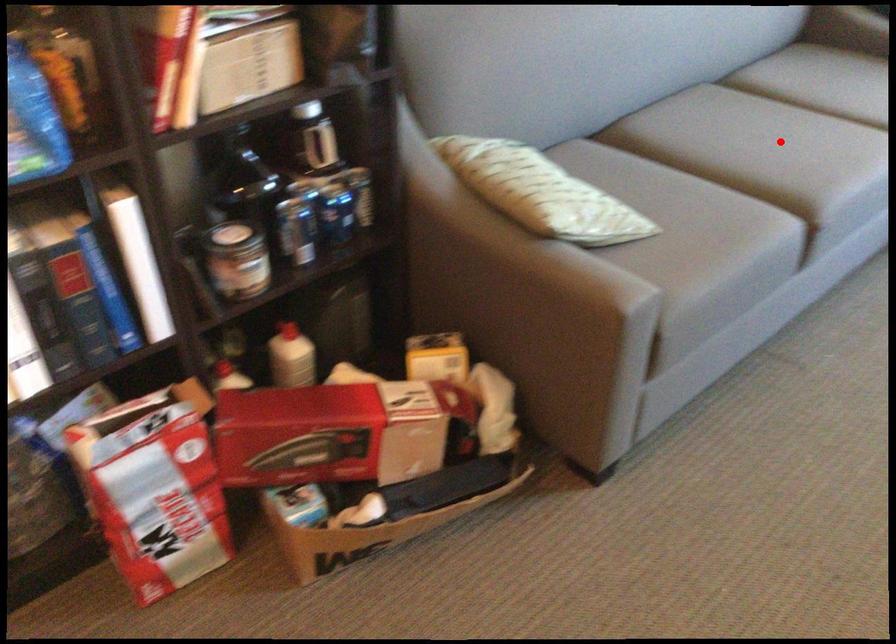
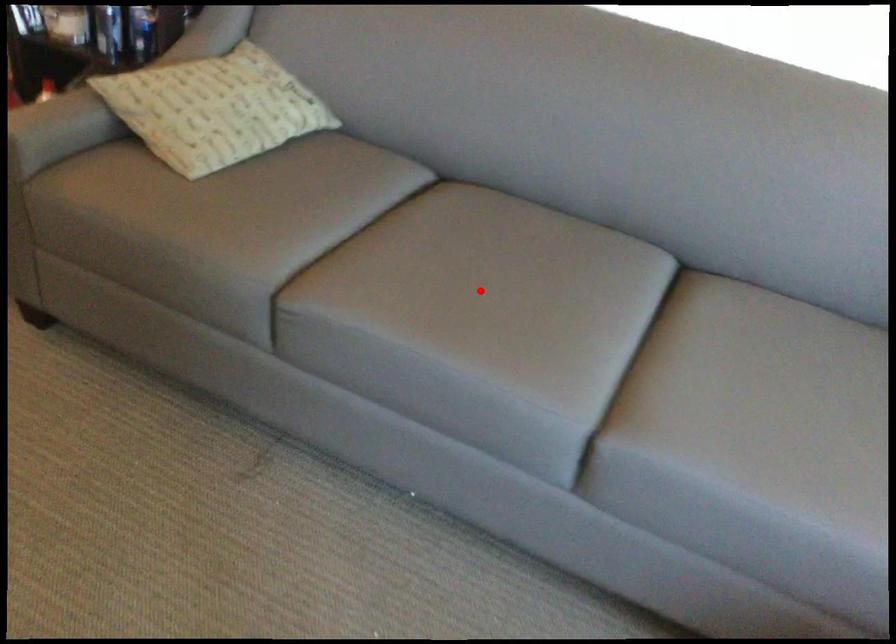
I am providing you with two images of the same scene from different viewpoints. A red point is marked on the first image and another point is marked on the second image. Are the points marked in image1 and image2 representing the same 3D position?

Yes